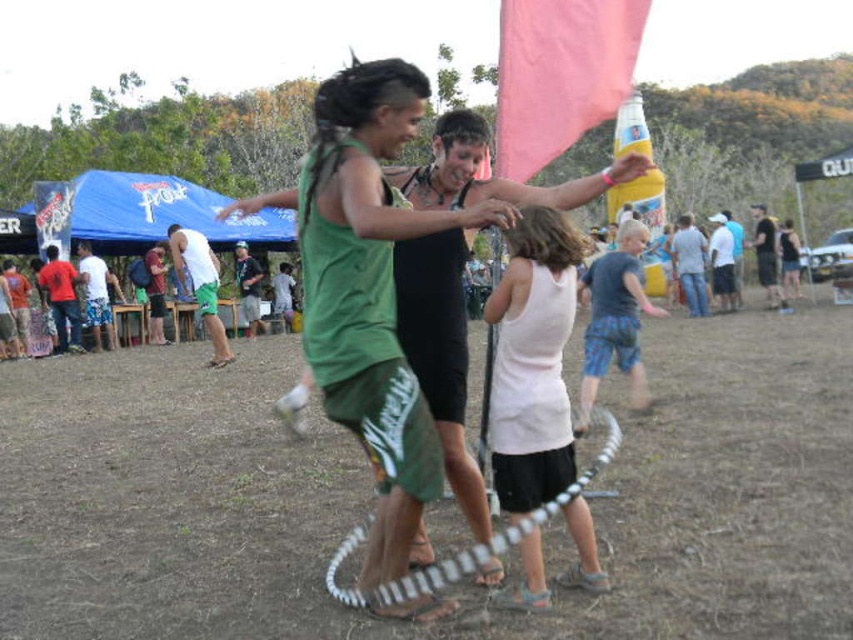
You are a photographer standing at the center of the scene. You want to capture a photo that includes both the white matte shorts at center and the jeans at right. What is the minimum distance you need to move backward to ensure both objects are in frame?

To include both the white matte shorts at center and the jeans at right, which are 9.79 meters apart, you need to move backward until the camera can capture a field of view wide enough to encompass 9.79 meters at that distance. The exact distance depends on the camera lens, but generally, moving back several meters should suffice.